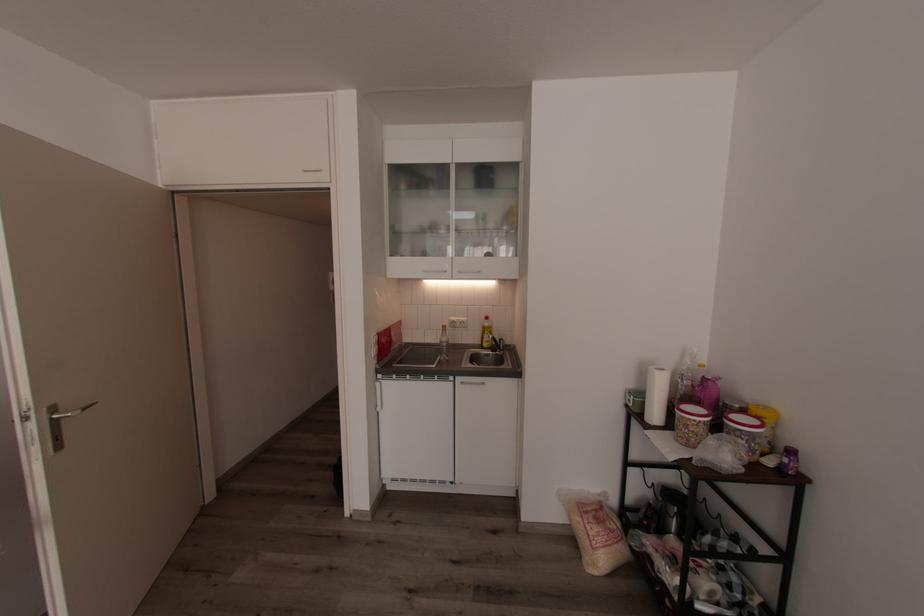
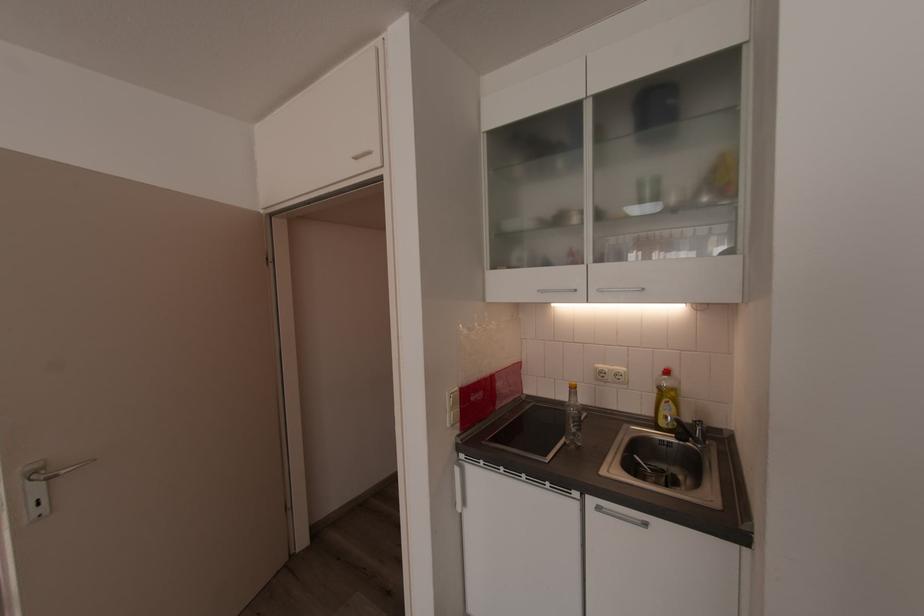
Question: Based on the continuous images, in which direction is the camera rotating? Reply with the corresponding letter.

Choices:
 (A) Left
 (B) Right
 (C) Up
 (D) Down

Answer: (A)